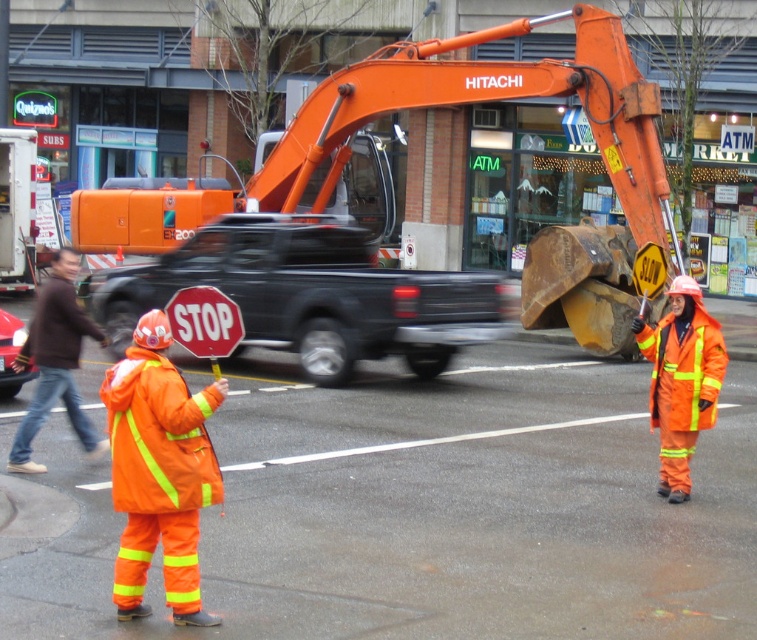
Question: Is high-visibility orange jacket at left bigger than smooth red stop sign at center?

Choices:
 (A) yes
 (B) no

Answer: (A)

Question: Which point appears closest to the camera in this image?

Choices:
 (A) (131, 497)
 (B) (615, 349)
 (C) (72, 273)
 (D) (637, 316)

Answer: (A)

Question: Is black matte truck at center to the left of high-visibility orange jacket at left from the viewer's perspective?

Choices:
 (A) no
 (B) yes

Answer: (B)

Question: Which of the following is the farthest from the observer?

Choices:
 (A) black matte truck at center
 (B) smooth red stop sign at center
 (C) orange reflective jacket at right
 (D) brown leather jacket at left

Answer: (A)

Question: Can you confirm if high-visibility orange jacket at left is smaller than smooth red stop sign at center?

Choices:
 (A) yes
 (B) no

Answer: (B)

Question: Which point is farther to the camera?

Choices:
 (A) (11, 300)
 (B) (70, 349)
 (C) (167, 515)
 (D) (528, 28)

Answer: (A)